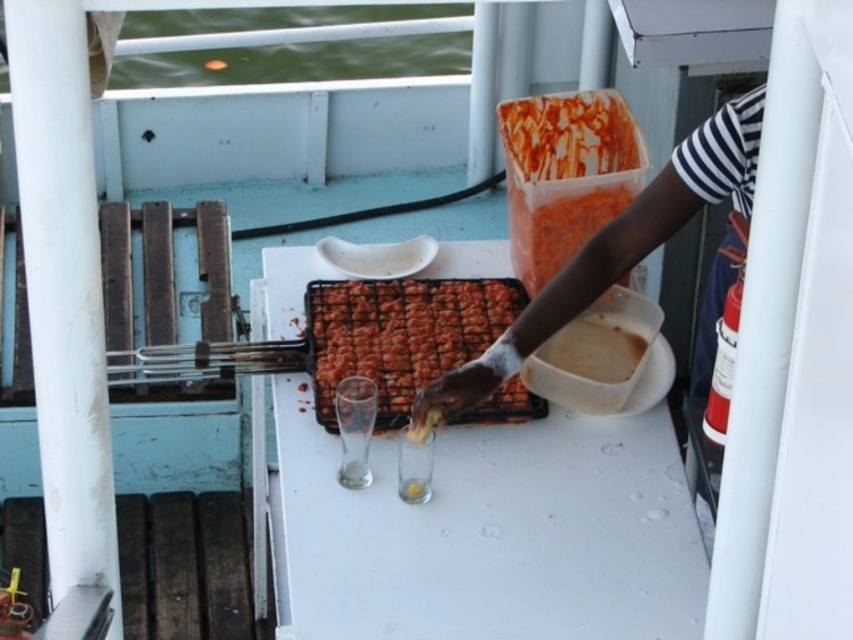
Which is in front, point (759, 106) or point (345, 298)?

Point (759, 106) is more forward.

This screenshot has height=640, width=853. What do you see at coordinates (618, 248) in the screenshot? I see `dark skin arm at center` at bounding box center [618, 248].

I want to click on dark skin arm at center, so click(x=618, y=248).

Identify the location of dark skin arm at center. The width and height of the screenshot is (853, 640). (618, 248).

Measure the distance from reddish-brown crispy skewers at center to matte plastic container at upper center.

reddish-brown crispy skewers at center is 19.97 inches from matte plastic container at upper center.

What do you see at coordinates (399, 333) in the screenshot?
I see `reddish-brown crispy skewers at center` at bounding box center [399, 333].

Identify the location of reddish-brown crispy skewers at center. This screenshot has height=640, width=853. (399, 333).

Can you confirm if dark skin arm at center is positioned below white matte plastic container at center-right?

No.

At what (x,y) coordinates should I click in order to perform the action: click on dark skin arm at center. Please return your answer as a coordinate pair (x, y). This screenshot has height=640, width=853. Looking at the image, I should click on (618, 248).

Which is in front, point (746, 122) or point (613, 346)?

Point (746, 122) is more forward.

Where is `dark skin arm at center`? The image size is (853, 640). dark skin arm at center is located at coordinates (618, 248).